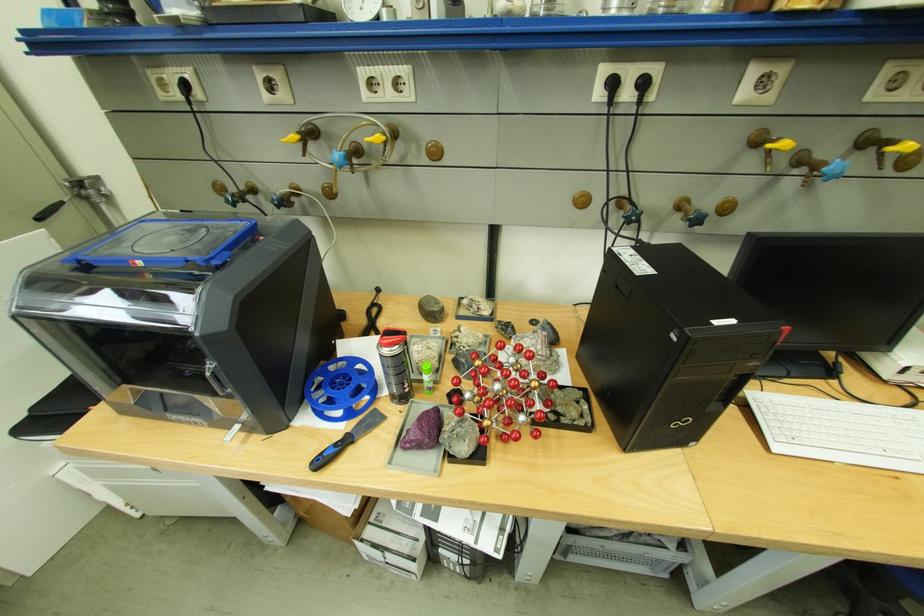
What do you see at coordinates (433, 150) in the screenshot? Image resolution: width=924 pixels, height=616 pixels. I see `the round drawer knob` at bounding box center [433, 150].